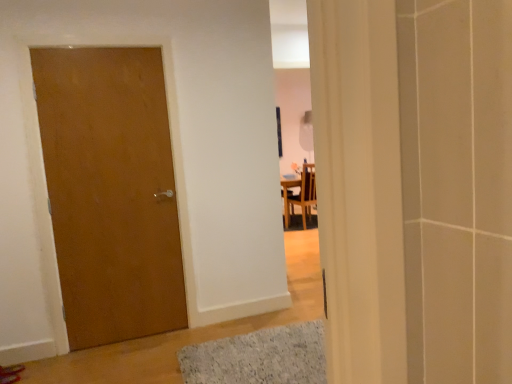
The height and width of the screenshot is (384, 512). Identify the location of free space above gray textured bath mat at lower center (from a real-world perspective). (261, 361).